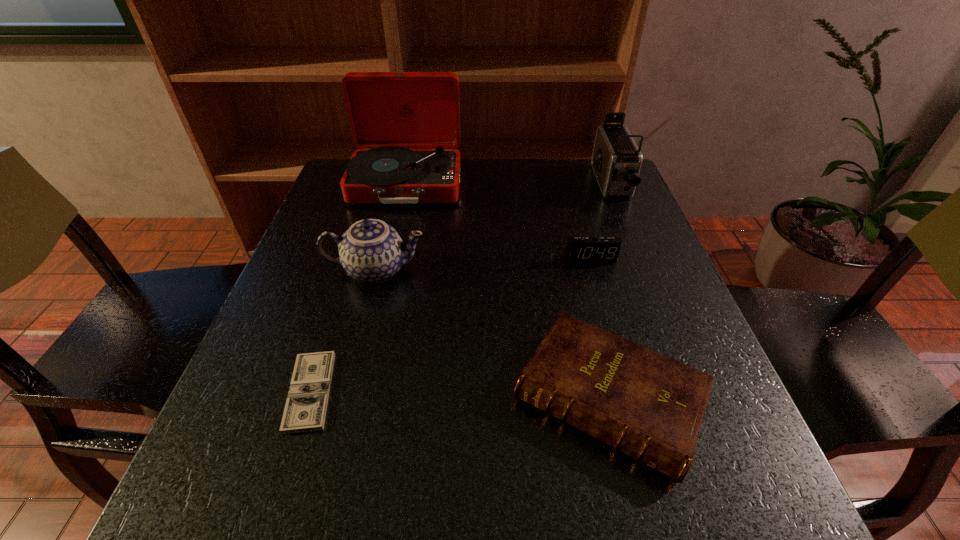
Locate an element on the screen. The image size is (960, 540). hardback book positioned at the right edge is located at coordinates (648, 406).

Identify the location of object located at the far left corner. This screenshot has width=960, height=540. (407, 124).

The width and height of the screenshot is (960, 540). Find the location of `object that is at the far right corner`. object that is at the far right corner is located at coordinates (616, 160).

Where is `object present at the near right corner`? The height and width of the screenshot is (540, 960). object present at the near right corner is located at coordinates (648, 406).

Locate an element on the screen. This screenshot has height=540, width=960. vacant space at the far edge is located at coordinates (483, 194).

Find the location of a particular element. free region at the near edge of the desktop is located at coordinates (419, 499).

Identify the location of free space at the left edge. (327, 252).

Where is `vacant area at the right edge`? The image size is (960, 540). vacant area at the right edge is located at coordinates (609, 323).

This screenshot has height=540, width=960. I want to click on vacant area at the near left corner, so click(x=236, y=506).

You are a GUI agent. You are given a task and a screenshot of the screen. Output one action in this format:
    pyautogui.click(x=<x>, y=<y>)
    Task: Click on the free point at the near right corner
    This screenshot has height=540, width=960.
    Given the screenshot: What is the action you would take?
    pyautogui.click(x=719, y=475)